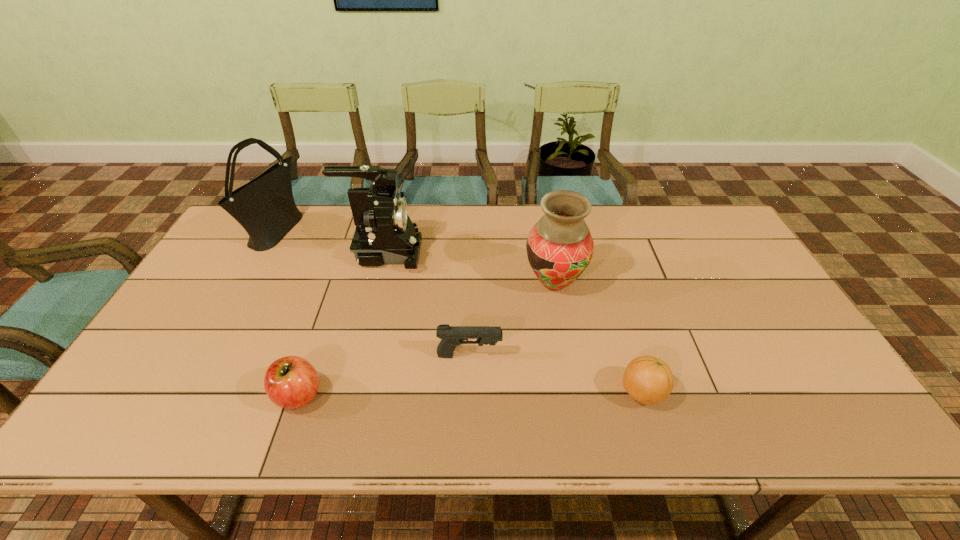
Where is `the leftmost object`? Image resolution: width=960 pixels, height=540 pixels. the leftmost object is located at coordinates (265, 207).

Find the location of a particular element. camcorder is located at coordinates (385, 235).

I want to click on vase, so click(x=559, y=247).

I want to click on apple, so click(291, 382).

Identify the location of pistol. (452, 336).

I want to click on the third object from right to left, so click(452, 336).

The height and width of the screenshot is (540, 960). In order to click on orange in this screenshot , I will do `click(649, 380)`.

Locate an element on the screen. This screenshot has width=960, height=540. vacant space located 0.280m on the right of the shoulder bag is located at coordinates (379, 232).

Locate an element on the screen. This screenshot has height=540, width=960. vacant position located 0.160m on the lens mount of the camcorder is located at coordinates (473, 252).

This screenshot has width=960, height=540. I want to click on free space located on the right of the second object from right to left, so click(660, 283).